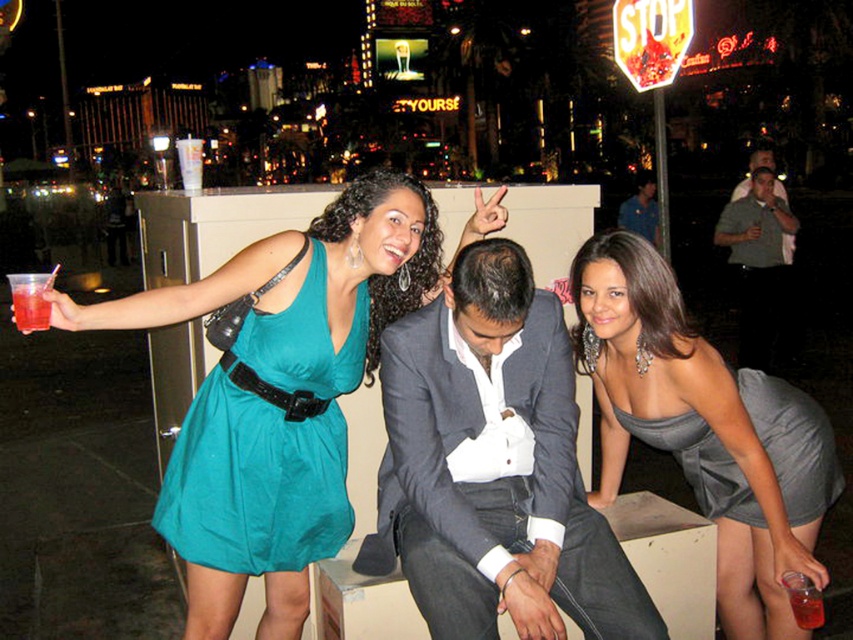
Which is more to the left, satin gray dress at lower right or teal satin dress at left?

From the viewer's perspective, teal satin dress at left appears more on the left side.

Describe the element at coordinates (705, 429) in the screenshot. I see `satin gray dress at lower right` at that location.

This screenshot has height=640, width=853. Describe the element at coordinates (705, 429) in the screenshot. I see `satin gray dress at lower right` at that location.

The height and width of the screenshot is (640, 853). In order to click on satin gray dress at lower right in this screenshot , I will do `click(705, 429)`.

Does point (834, 481) come in front of point (21, 321)?

No, it is not.

Which is below, gray satin dress at lower right or translucent plastic cup at upper left?

gray satin dress at lower right is below.

Find the location of a particular element. gray satin dress at lower right is located at coordinates click(x=793, y=444).

Is gray satin dress at lower right positioned behind blue denim shirt at upper right?

No, it is not.

Who is more distant from viewer, (717,444) or (627,212)?

The point (627,212) is behind.

Who is more forward, (682, 467) or (637, 224)?

Point (682, 467) is more forward.

Identify the location of gray satin dress at lower right. This screenshot has width=853, height=640. (793, 444).